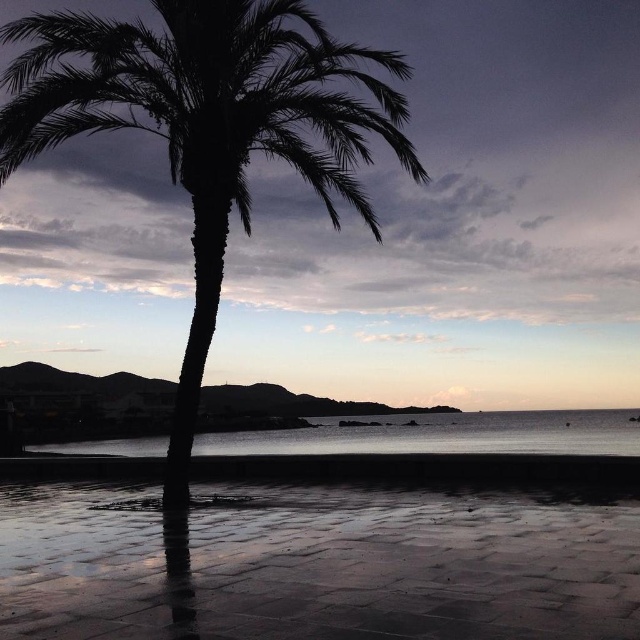
Is reflective wet sand at lower center smaller than transparent water at center?

Yes.

Between reflective wet sand at lower center and transparent water at center, which one has more height?

transparent water at center is taller.

Is point (99, 492) closer to viewer compared to point (112, 440)?

Yes, it is.

Where is `reflective wet sand at lower center`? reflective wet sand at lower center is located at coordinates (317, 564).

Between reflective wet sand at lower center and silhouette leafy palm at center, which one appears on the left side from the viewer's perspective?

silhouette leafy palm at center

From the picture: Is reflective wet sand at lower center in front of silhouette leafy palm at center?

Yes, reflective wet sand at lower center is in front of silhouette leafy palm at center.

Between point (426, 632) and point (13, 141), which one is positioned in front?

Point (426, 632)

This screenshot has height=640, width=640. I want to click on reflective wet sand at lower center, so click(x=317, y=564).

Is silhouette leafy palm at center to the right of transparent water at center from the viewer's perspective?

In fact, silhouette leafy palm at center is to the left of transparent water at center.

Is silhouette leafy palm at center taller than transparent water at center?

Correct, silhouette leafy palm at center is much taller as transparent water at center.

Which is behind, point (116, 28) or point (417, 420)?

The point (417, 420) is more distant.

This screenshot has width=640, height=640. Find the location of `silhouette leafy palm at center`. silhouette leafy palm at center is located at coordinates (205, 124).